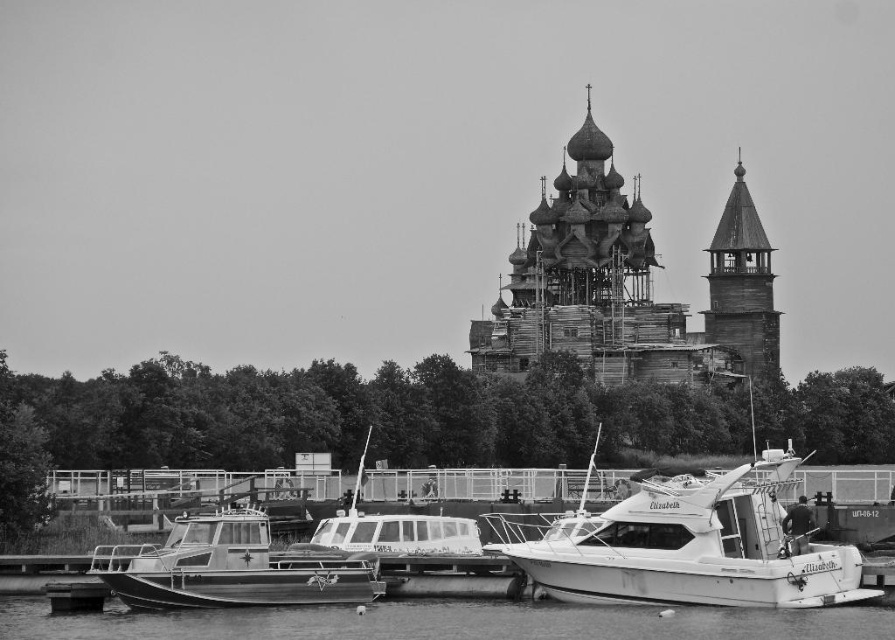
You are standing at the waterfront and want to know how far the metallic gray boat at lower left is from you. Can you determine the distance based on the scene?

The metallic gray boat at lower left is 373.67 feet away from the viewer.

You are a photographer standing at the waterfront. You want to take a photo of both the wooden church at center and the metallic gray boat at lower left. Which object will appear larger in the photo?

The wooden church at center will appear larger in the photo because it is much taller than the metallic gray boat at lower left.